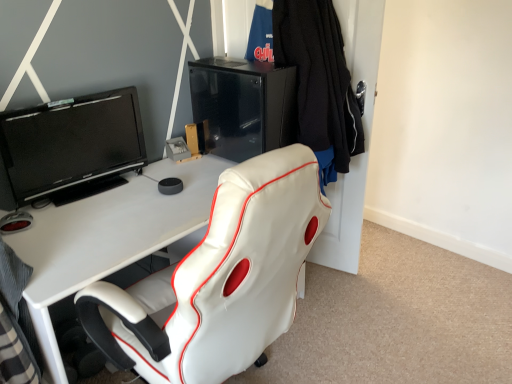
Question: From the image's perspective, is black glossy screen at upper left positioned above or below black knitted sweater at upper right?

Choices:
 (A) below
 (B) above

Answer: (A)

Question: From a real-world perspective, is black glossy screen at upper left above or below black knitted sweater at upper right?

Choices:
 (A) below
 (B) above

Answer: (A)

Question: Based on their relative distances, which object is farther from the matte black entertainment center at upper center?

Choices:
 (A) black glossy screen at upper left
 (B) black knitted sweater at upper right
 (C) black glossy/file cabinet at upper center

Answer: (A)

Question: Which object is the farthest from the black glossy/file cabinet at upper center?

Choices:
 (A) black glossy screen at upper left
 (B) black knitted sweater at upper right
 (C) matte black entertainment center at upper center

Answer: (C)